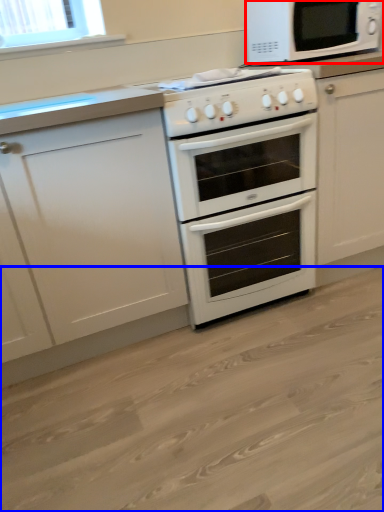
Question: Which object is closer to the camera taking this photo, microwave oven (highlighted by a red box) or plain (highlighted by a blue box)?

Choices:
 (A) microwave oven
 (B) plain

Answer: (B)